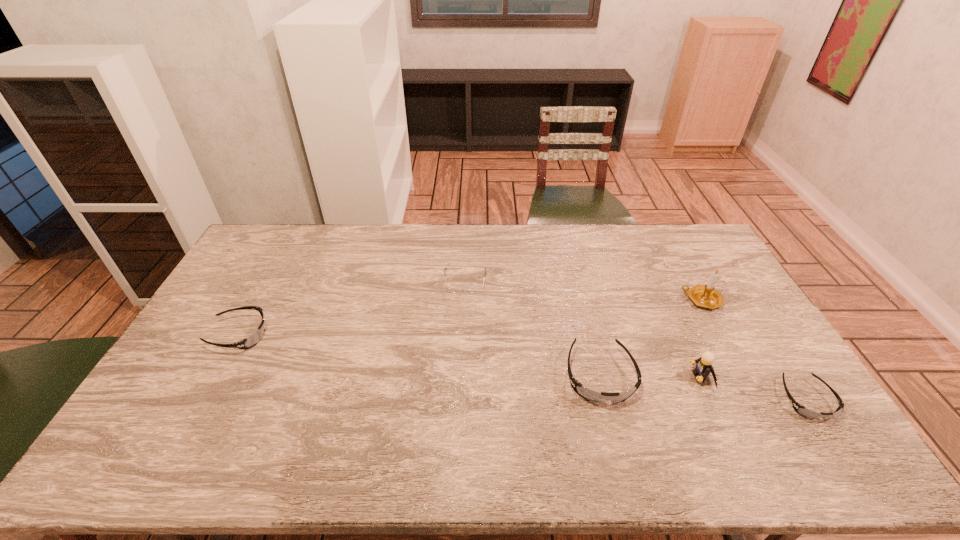
Please point a location where one more sunglasses can be added evenly. Please provide its 2D coordinates. Your answer should be formatted as a tuple, i.e. [(x, y)], where the tuple contains the x and y coordinates of a point satisfying the conditions above.

[(412, 354)]